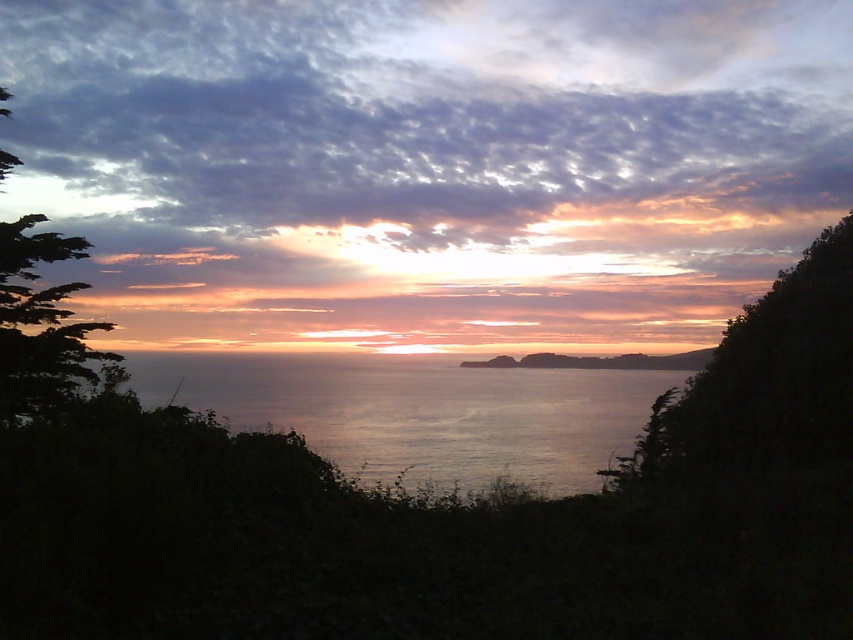
Can you confirm if silvery water at center is thinner than green leafy tree at left?

No.

Is silvery water at center smaller than green leafy tree at left?

No, silvery water at center is not smaller than green leafy tree at left.

Who is more forward, (193, 406) or (33, 404)?

Positioned in front is point (33, 404).

Identify the location of silvery water at center. The image size is (853, 640). (421, 412).

Where is `cloudy sky at upper center`? cloudy sky at upper center is located at coordinates (433, 124).

Can you confirm if cloudy sky at upper center is positioned to the left of green leafy tree at left?

Incorrect, cloudy sky at upper center is not on the left side of green leafy tree at left.

Find the location of a particular element. This screenshot has width=853, height=640. cloudy sky at upper center is located at coordinates (433, 124).

Is cloudy sky at upper center positioned at the back of silvery water at center?

Yes.

Does cloudy sky at upper center have a greater width compared to silvery water at center?

Indeed, cloudy sky at upper center has a greater width compared to silvery water at center.

Is point (421, 202) positioned after point (318, 387)?

Yes.

Locate an element on the screen. cloudy sky at upper center is located at coordinates (433, 124).